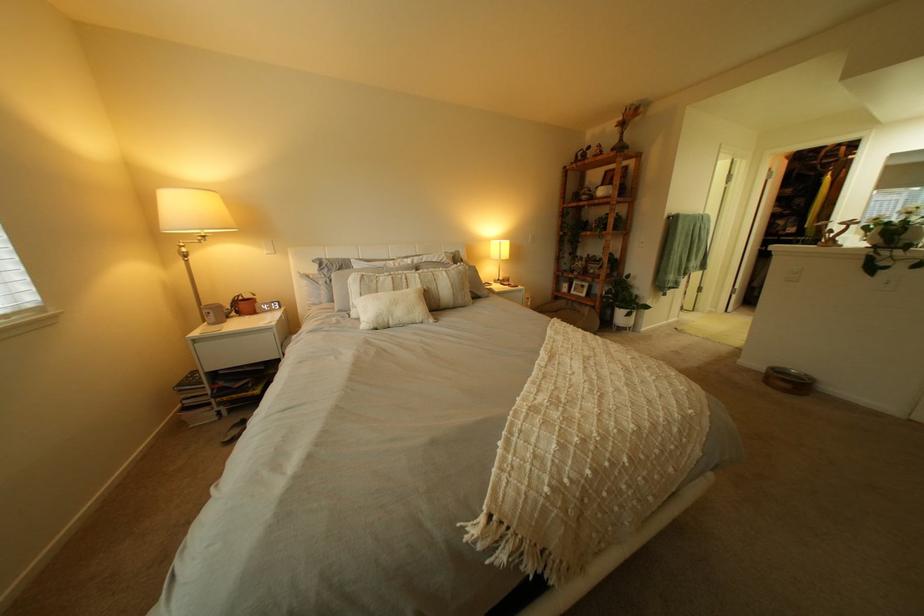
The location [586,454] corresponds to which object?

It corresponds to the woven throw blanket in the image.